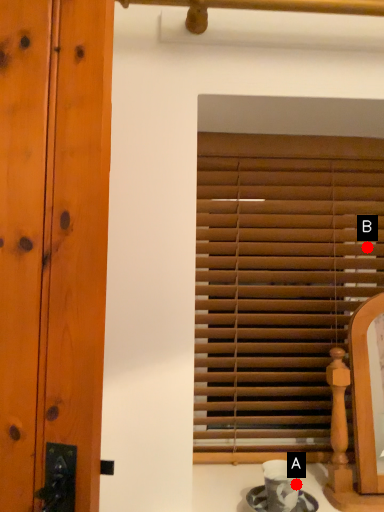
Question: Two points are circled on the image, labeled by A and B beside each circle. Which point is farther to the camera?

Choices:
 (A) A is further
 (B) B is further

Answer: (B)